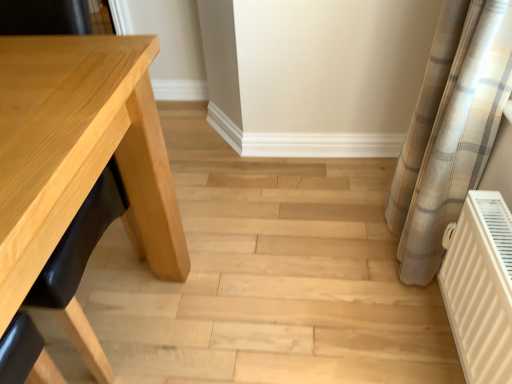
At what (x,y) coordinates should I click in order to perform the action: click on free space above natural wood table at left (from a real-world perspective). Please return your answer as a coordinate pair (x, y). This screenshot has width=512, height=384. Looking at the image, I should click on (250, 225).